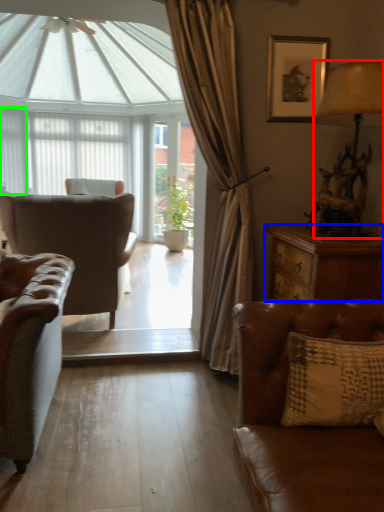
Question: Which object is positioned farthest from lamp (highlighted by a red box)? Select from desk (highlighted by a blue box) and shutter (highlighted by a green box).

Choices:
 (A) desk
 (B) shutter

Answer: (B)